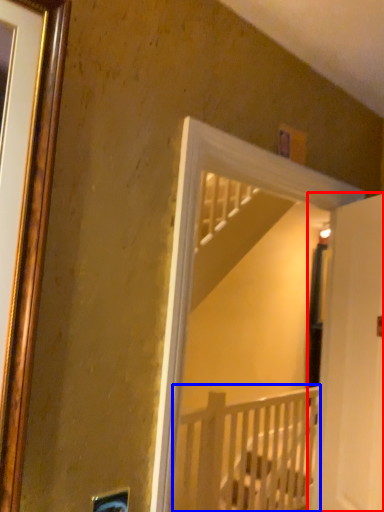
Question: Which object is further to the camera taking this photo, door (highlighted by a red box) or infant bed (highlighted by a blue box)?

Choices:
 (A) door
 (B) infant bed

Answer: (B)